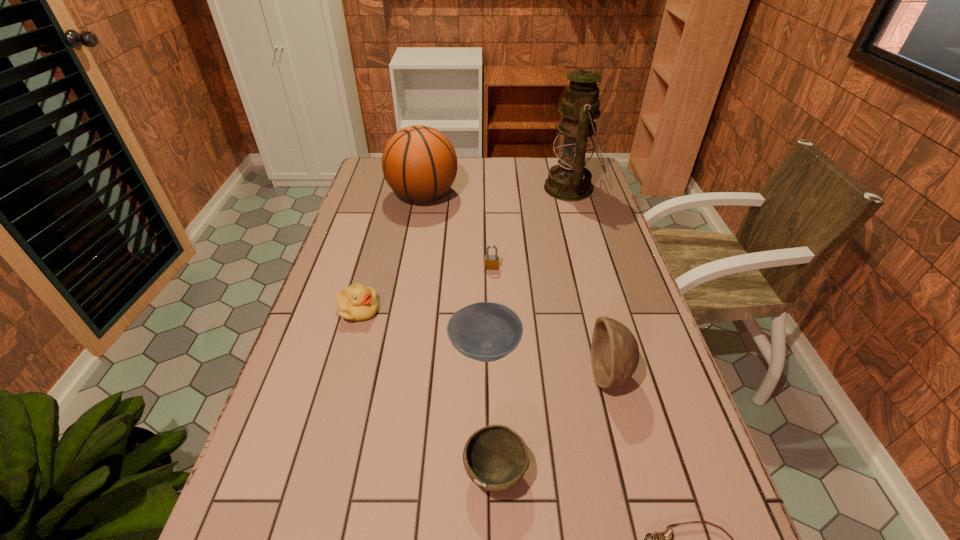
Locate an element on the screen. free space between the nearest bowl and the sixth shortest object is located at coordinates (552, 424).

You are a GUI agent. You are given a task and a screenshot of the screen. Output one action in this format:
    pyautogui.click(x=<x>, y=<y>)
    Task: Click on the object that is the seventh closest to the goggles
    
    Given the screenshot: What is the action you would take?
    pyautogui.click(x=419, y=163)

Identify the location of object that stands as the sixth closest to the sixth nearest object. (495, 457).

Point out which bowl is positioned as the second nearest to the nearest bowl. Please provide its 2D coordinates. Your answer should be formatted as a tuple, i.e. [(x, y)], where the tuple contains the x and y coordinates of a point satisfying the conditions above.

[(614, 350)]

The image size is (960, 540). In order to click on the third closest bowl to the oil lamp in this screenshot , I will do `click(495, 457)`.

Identify the location of free location that satisfies the following two spatial constraints: 1. on the beak of the nearest bowl; 2. on the right side of the duckling. (313, 472).

You are a GUI agent. You are given a task and a screenshot of the screen. Output one action in this format:
    pyautogui.click(x=<x>, y=<y>)
    Task: Click on the vacant space that satisfies the following two spatial constraints: 1. on the back side of the tallest bowl; 2. on the beak of the duckling
    
    Given the screenshot: What is the action you would take?
    pyautogui.click(x=593, y=310)

Find the location of a particular element. free point that satisfies the following two spatial constraints: 1. on the beak of the rightmost bowl; 2. on the left side of the duckling is located at coordinates (341, 375).

This screenshot has height=540, width=960. I want to click on free space that satisfies the following two spatial constraints: 1. on the back side of the sixth nearest object; 2. on the left side of the seventh farthest object, so click(490, 267).